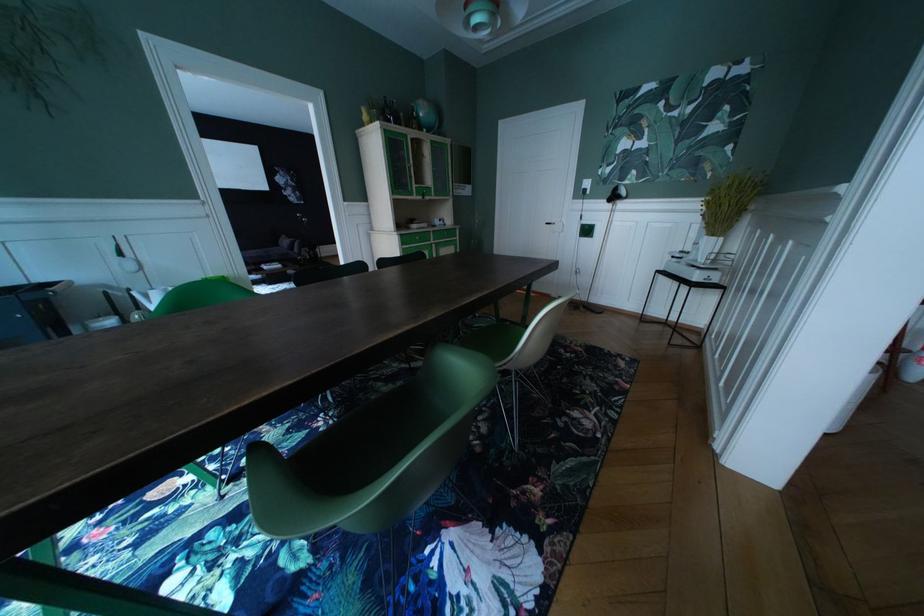
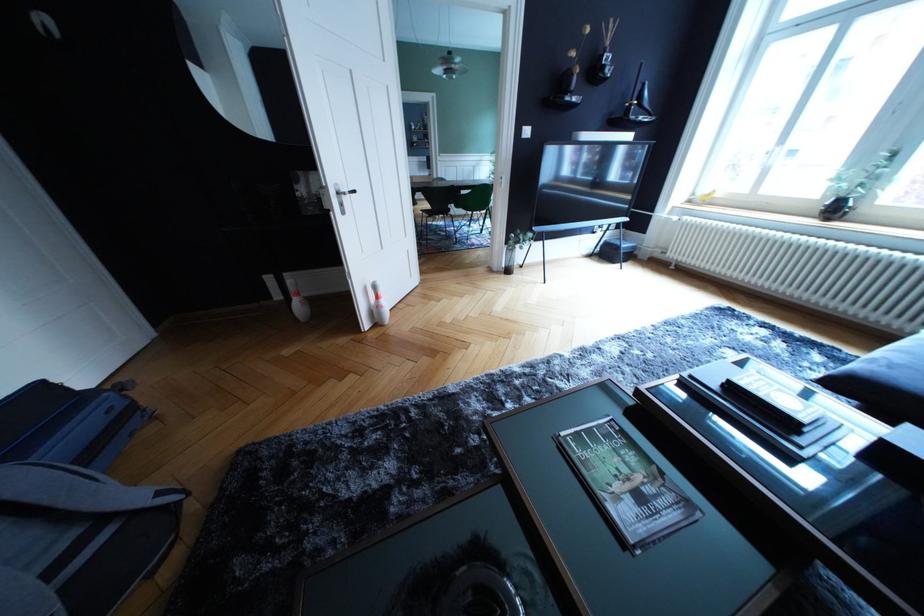
Question: I am providing you with two images of the same scene from different viewpoints. Which of the following objects are not visible in image2?

Choices:
 (A) green chair sitting surface
 (B) sofa armrest
 (C) pull-up bar handle
 (D) sofa sitting surface

Answer: (A)